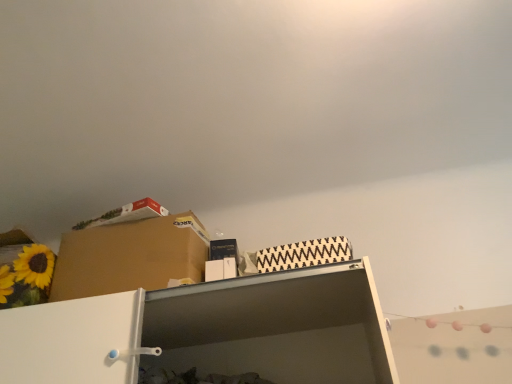
Question: Considering the positions of brown cardboard box at upper left and white matte shelf at upper center in the image, is brown cardboard box at upper left taller or shorter than white matte shelf at upper center?

Choices:
 (A) tall
 (B) short

Answer: (A)

Question: Considering the relative positions of brown cardboard box at upper left and white matte shelf at upper center in the image provided, is brown cardboard box at upper left to the left or to the right of white matte shelf at upper center?

Choices:
 (A) left
 (B) right

Answer: (A)

Question: Considering the positions of brown cardboard box at upper left and white matte shelf at upper center in the image, is brown cardboard box at upper left bigger or smaller than white matte shelf at upper center?

Choices:
 (A) big
 (B) small

Answer: (A)

Question: Considering the positions of white matte shelf at upper center and brown cardboard box at upper left in the image, is white matte shelf at upper center wider or thinner than brown cardboard box at upper left?

Choices:
 (A) thin
 (B) wide

Answer: (B)

Question: Considering the relative positions of white matte shelf at upper center and brown cardboard box at upper left in the image provided, is white matte shelf at upper center to the left or to the right of brown cardboard box at upper left?

Choices:
 (A) left
 (B) right

Answer: (B)

Question: From a real-world perspective, is white matte shelf at upper center positioned above or below brown cardboard box at upper left?

Choices:
 (A) above
 (B) below

Answer: (B)

Question: In terms of height, does white matte shelf at upper center look taller or shorter compared to brown cardboard box at upper left?

Choices:
 (A) short
 (B) tall

Answer: (A)